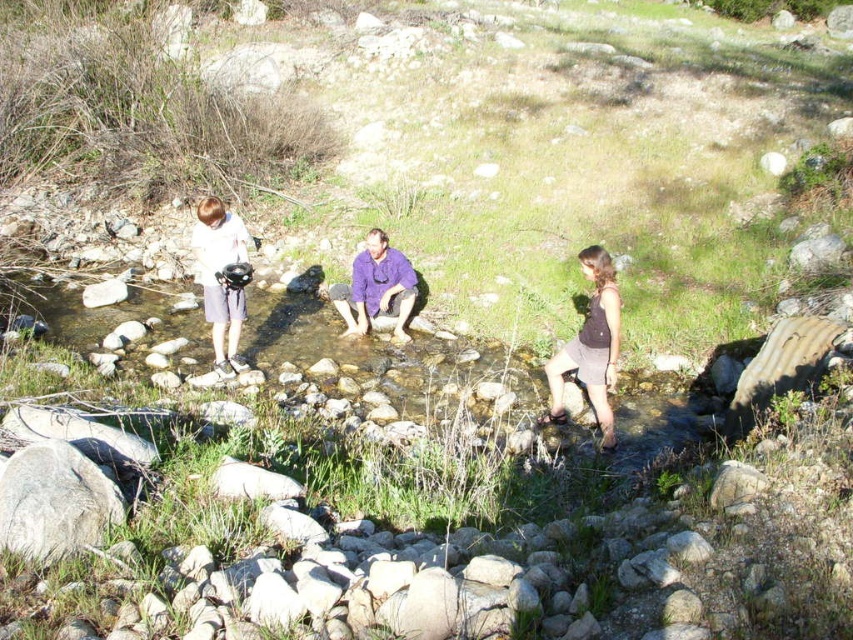
Question: Which is nearer to the matte black helmet at left?

Choices:
 (A) dark gray fabric skirt at center
 (B) purple cotton shirt at center

Answer: (B)

Question: Does dark gray fabric skirt at center appear under purple cotton shirt at center?

Choices:
 (A) yes
 (B) no

Answer: (A)

Question: Where is matte black helmet at left located in relation to purple cotton shirt at center in the image?

Choices:
 (A) below
 (B) above

Answer: (B)

Question: Can you confirm if dark gray fabric skirt at center is positioned to the left of matte black helmet at left?

Choices:
 (A) yes
 (B) no

Answer: (B)

Question: Which of the following is the closest to the observer?

Choices:
 (A) matte black helmet at left
 (B) purple cotton shirt at center

Answer: (A)

Question: Which is nearer to the purple cotton shirt at center?

Choices:
 (A) matte black helmet at left
 (B) dark gray fabric skirt at center

Answer: (A)